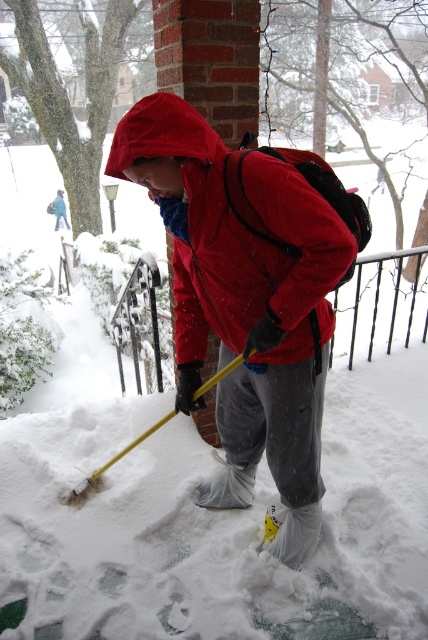
You are a snow removal worker who needs to choose a tool to clear a narrow pathway between two snowdrifts. Based on the image, which tool would be more suitable between the yellow plastic shovel at lower center and the matte black snow shovel at lower left?

The yellow plastic shovel at lower center occupies less space than the matte black snow shovel at lower left, making it more suitable for narrow pathways.

Where is the matte nylon jacket at center located in the image?

The matte nylon jacket at center is located at point (297, 244) in the image.

You are standing at the brick pillar and want to walk to the snow rake. Which point, point (151,180) or point (124,451), is closer to you?

Point (151,180) is closer to the viewer than point (124,451), so you should head towards point (151,180) to reach the snow rake more quickly.